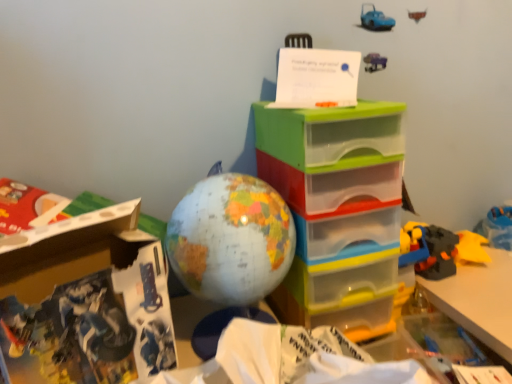
Identify the location of white cardboard box at lower left. This screenshot has width=512, height=384. (85, 301).

Measure the distance between point [64,345] and camera.

The depth of point [64,345] is 18.46 inches.

Image resolution: width=512 pixels, height=384 pixels. Describe the element at coordinates (231, 239) in the screenshot. I see `map-patterned globe at center` at that location.

In order to face map-patterned globe at center, should I rotate leftwards or rightwards?

Rotate left and turn 3.851 degrees.

Locate an element on the screen. The image size is (512, 384). translucent plastic drawers at center is located at coordinates (337, 211).

Consider the image. Considering the relative sizes of translucent plastic drawers at center and white cardboard box at lower left in the image provided, is translucent plastic drawers at center smaller than white cardboard box at lower left?

No.

Is white cardboard box at lower left a part of translucent plastic drawers at center?

No, white cardboard box at lower left is not surrounded by translucent plastic drawers at center.

Between translucent plastic drawers at center and white cardboard box at lower left, which one has larger width?

translucent plastic drawers at center.

Find the location of a particular element. This screenshot has width=512, height=384. toy that appears above the translucent plastic drawers at center (from the image's perspective) is located at coordinates (231, 239).

Is map-patterned globe at center far from translucent plastic drawers at center?

Actually, map-patterned globe at center and translucent plastic drawers at center are a little close together.

Who is taller, map-patterned globe at center or translucent plastic drawers at center?

translucent plastic drawers at center is taller.

Is point (281, 167) closer to viewer compared to point (267, 193)?

No.

Can you see translucent plastic drawers at center touching map-patterned globe at center?

They are not placed beside each other.

The width and height of the screenshot is (512, 384). Find the location of `toy above the translucent plastic drawers at center (from the image's perspective)`. toy above the translucent plastic drawers at center (from the image's perspective) is located at coordinates (231, 239).

Which object is positioned more to the left, white cardboard box at lower left or map-patterned globe at center?

white cardboard box at lower left is more to the left.

Based on the photo, which of these two, white cardboard box at lower left or map-patterned globe at center, is smaller?

white cardboard box at lower left is smaller.

Is map-patterned globe at center far away from white cardboard box at lower left?

map-patterned globe at center is near white cardboard box at lower left, not far away.

Looking at this image, considering the relative positions of map-patterned globe at center and white cardboard box at lower left in the image provided, is map-patterned globe at center in front of white cardboard box at lower left?

No, map-patterned globe at center is further to the viewer.

What's the angular difference between map-patterned globe at center and white cardboard box at lower left's facing directions?

map-patterned globe at center and white cardboard box at lower left are facing 23.3 degrees away from each other.

How different are the orientations of white cardboard box at lower left and translucent plastic drawers at center in degrees?

white cardboard box at lower left and translucent plastic drawers at center are facing 27.3 degrees away from each other.

In the image, is white cardboard box at lower left on the left side or the right side of translucent plastic drawers at center?

white cardboard box at lower left is to the left of translucent plastic drawers at center.

From a real-world perspective, which is physically above, white cardboard box at lower left or translucent plastic drawers at center?

In real-world perspective, white cardboard box at lower left is above.

Is point (72, 290) in front of point (295, 303)?

Yes.

You are a GUI agent. You are given a task and a screenshot of the screen. Output one action in this format:
    pyautogui.click(x=<x>, y=<y>)
    Task: Click on the storage box above the white cardboard box at lower left (from the image's perspective)
    The width and height of the screenshot is (512, 384).
    Given the screenshot: What is the action you would take?
    (x=337, y=211)

Where is `storage box that is below the map-patterned globe at center (from the image's perspective)`? Image resolution: width=512 pixels, height=384 pixels. storage box that is below the map-patterned globe at center (from the image's perspective) is located at coordinates [337, 211].

When comparing their distances from white cardboard box at lower left, does map-patterned globe at center or translucent plastic drawers at center seem further?

translucent plastic drawers at center is positioned further to the anchor white cardboard box at lower left.

Estimate the real-world distances between objects in this image. Which object is closer to translucent plastic drawers at center, white cardboard box at lower left or map-patterned globe at center?

map-patterned globe at center is positioned closer to the anchor translucent plastic drawers at center.

Looking at the image, which one is located closer to white cardboard box at lower left, translucent plastic drawers at center or map-patterned globe at center?

Based on the image, map-patterned globe at center appears to be nearer to white cardboard box at lower left.

From the image, which object appears to be farther from map-patterned globe at center, translucent plastic drawers at center or white cardboard box at lower left?

Based on the image, white cardboard box at lower left appears to be further to map-patterned globe at center.

When comparing their distances from translucent plastic drawers at center, does map-patterned globe at center or white cardboard box at lower left seem closer?

Among the two, map-patterned globe at center is located nearer to translucent plastic drawers at center.

When comparing their distances from map-patterned globe at center, does white cardboard box at lower left or translucent plastic drawers at center seem further?

white cardboard box at lower left is further to map-patterned globe at center.

This screenshot has height=384, width=512. I want to click on toy between white cardboard box at lower left and translucent plastic drawers at center from left to right, so click(231, 239).